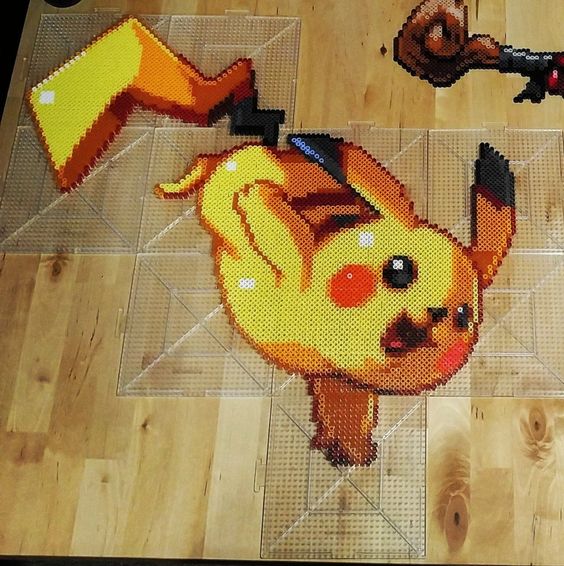
In order to click on knot in wood in this screenshot , I will do `click(462, 518)`, `click(540, 422)`, `click(52, 268)`.